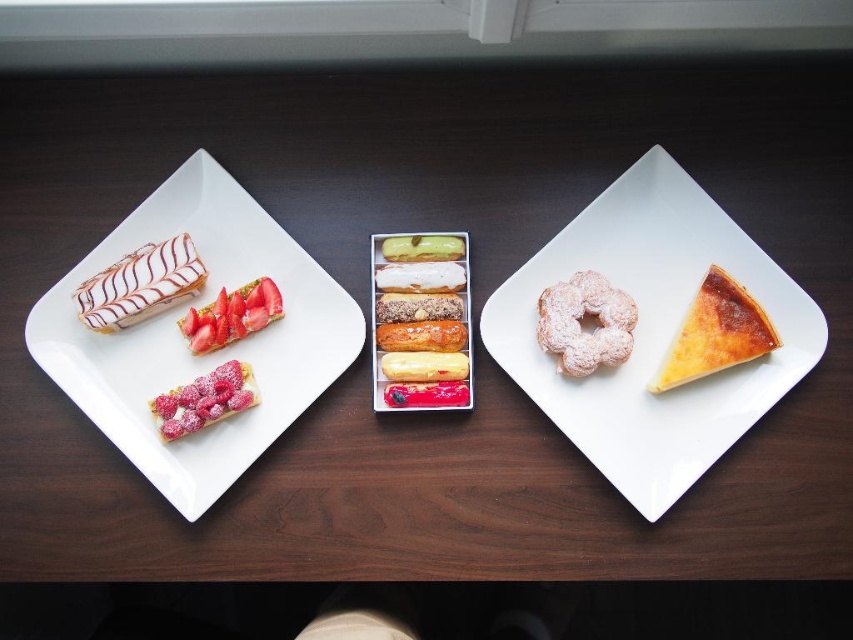
Is white glossy rectangular plate at upper left behind golden flaky pie at right?

That is True.

Locate an element on the screen. This screenshot has height=640, width=853. white glossy rectangular plate at upper left is located at coordinates (184, 340).

You are a GUI agent. You are given a task and a screenshot of the screen. Output one action in this format:
    pyautogui.click(x=<x>, y=<y>)
    Task: Click on the white glossy rectangular plate at upper left
    
    Given the screenshot: What is the action you would take?
    pyautogui.click(x=184, y=340)

Can you confirm if white matte plate at center is bigger than yellow cream puff at center?

Yes, white matte plate at center is bigger than yellow cream puff at center.

Who is higher up, white matte plate at center or yellow cream puff at center?

white matte plate at center

The height and width of the screenshot is (640, 853). I want to click on white matte plate at center, so click(x=653, y=332).

Which is in front, point (231, 314) or point (437, 344)?

Point (231, 314) is in front.

This screenshot has height=640, width=853. Find the location of `strawberry-topped pastry at upper left`. strawberry-topped pastry at upper left is located at coordinates (231, 316).